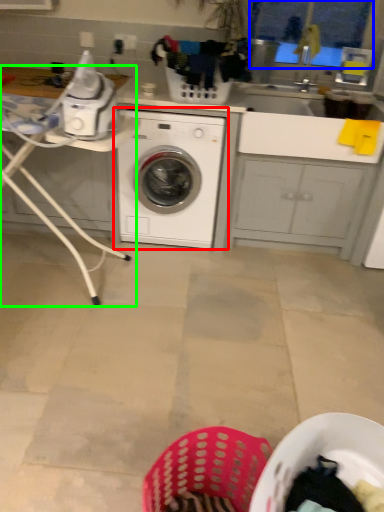
Question: Considering the real-world distances, which object is closest to washing machine (highlighted by a red box)? window screen (highlighted by a blue box) or table (highlighted by a green box).

Choices:
 (A) window screen
 (B) table

Answer: (B)